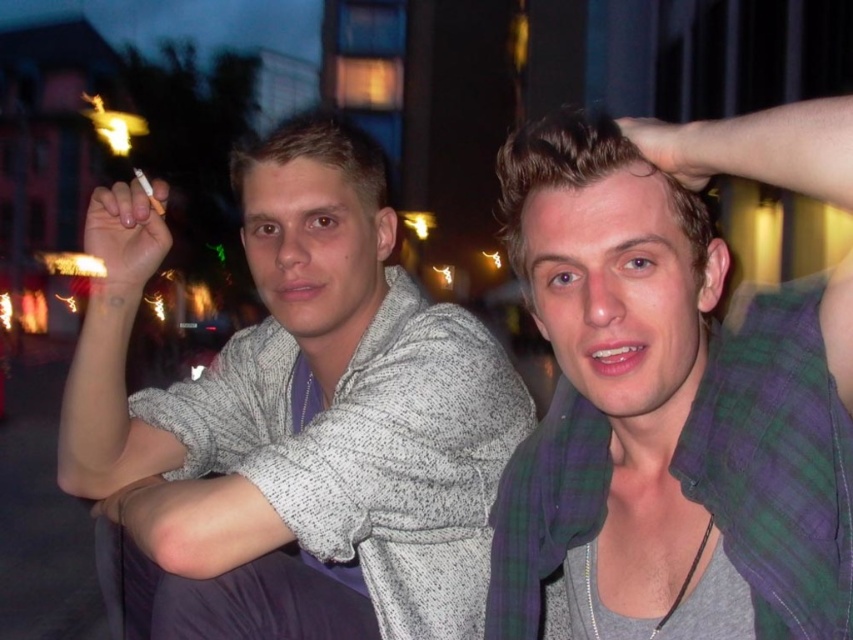
Question: Which point is farther from the camera taking this photo?

Choices:
 (A) (96, 280)
 (B) (297, 189)
 (C) (706, 134)

Answer: (A)

Question: Which point is closer to the camera taking this photo?

Choices:
 (A) (383, 300)
 (B) (160, 184)

Answer: (B)

Question: Among these objects, which one is farthest from the camera?

Choices:
 (A) white matte cigarette at upper left
 (B) green plaid scarf at upper right
 (C) speckled gray sweater at left

Answer: (A)

Question: Where is green plaid scarf at upper right located in relation to speckled gray sweater at left in the image?

Choices:
 (A) right
 (B) left

Answer: (A)

Question: Considering the relative positions of speckled gray sweater at left and white matte cigarette at upper left in the image provided, where is speckled gray sweater at left located with respect to white matte cigarette at upper left?

Choices:
 (A) below
 (B) above

Answer: (A)

Question: Is green plaid scarf at upper right wider than smooth skin hand at upper right?

Choices:
 (A) yes
 (B) no

Answer: (A)